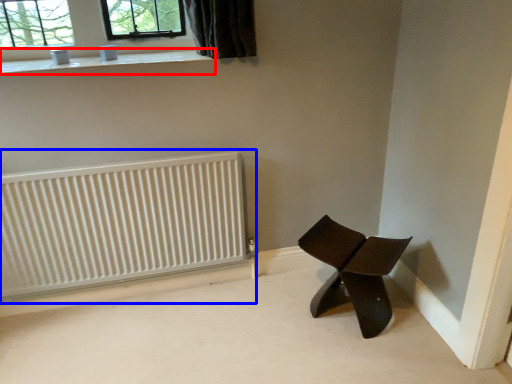
Question: Which object appears farthest to the camera in this image, window sill (highlighted by a red box) or radiator (highlighted by a blue box)?

Choices:
 (A) window sill
 (B) radiator

Answer: (B)